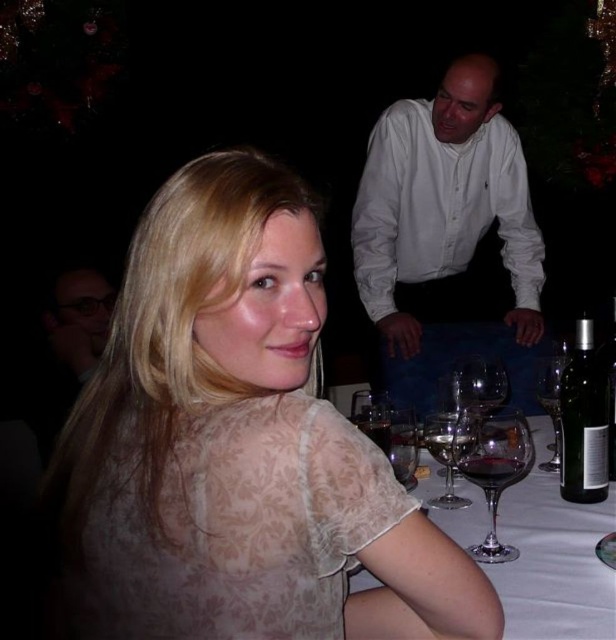
Between green glass bottle at right and dark red glass at table right, which one appears on the right side from the viewer's perspective?

green glass bottle at right is more to the right.

Looking at this image, does green glass bottle at right appear over dark red glass at table right?

Yes.

Between point (604, 493) and point (485, 470), which one is positioned in front?

Point (485, 470) is in front.

Find the location of a particular element. This screenshot has width=616, height=640. green glass bottle at right is located at coordinates (583, 420).

Does translucent floral dress at center have a lesser height compared to transparent glass at table right?

No, translucent floral dress at center is not shorter than transparent glass at table right.

Is translucent floral dress at center further to the viewer compared to transparent glass at table right?

No, it is in front of transparent glass at table right.

Is point (179, 632) positioned before point (367, 420)?

That is True.

The height and width of the screenshot is (640, 616). Find the location of `translucent floral dress at center`. translucent floral dress at center is located at coordinates (238, 444).

Is black glass bottle at right closer to camera compared to transparent glass at center?

That is False.

Is black glass bottle at right above transparent glass at center?

Indeed, black glass bottle at right is positioned over transparent glass at center.

Which is behind, point (610, 362) or point (431, 436)?

Positioned behind is point (610, 362).

The width and height of the screenshot is (616, 640). Find the location of `black glass bottle at right`. black glass bottle at right is located at coordinates (610, 387).